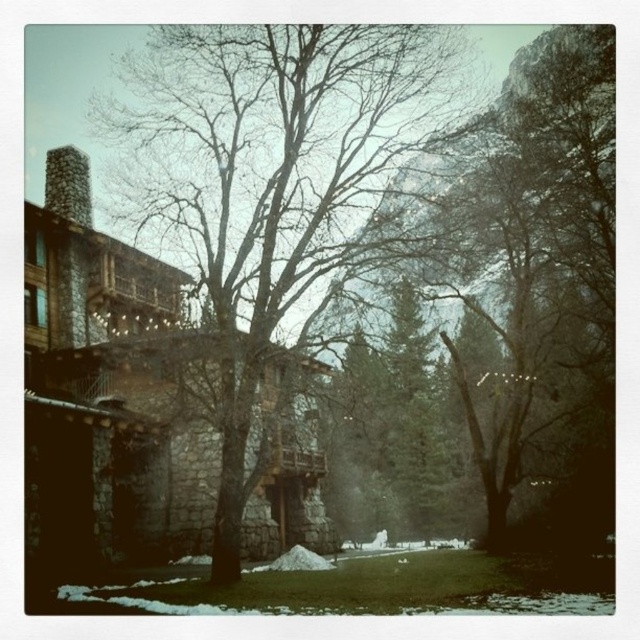
Looking at this image, you are standing in the winter scene and want to walk to the rustic stone building with wooden balconies and railings. There is a bare wood tree at center marked by point (275,182) in your way. Which direction should you move to avoid it?

To avoid the bare wood tree at center marked by point (275,182), you should move either to the left or right of the tree since it is directly in your path towards the rustic stone building with wooden balconies and railings.

Looking at this image, you are standing in front of the rustic stone building and want to take a photo of both the bare wood tree at center and the stone chimney at left. Which object should you zoom in on to ensure both are fully visible in the frame?

The bare wood tree at center is much taller than the stone chimney at left, so you should zoom in on the stone chimney at left to ensure both are fully visible in the frame.

You are standing in the winter scene and want to take a photo of the stone chimney at left without the bare wood tree at center blocking it. How should you move to ensure the tree is no longer in the way?

Move to the right side of the scene so that the bare wood tree at center is no longer between you and the stone chimney at left.